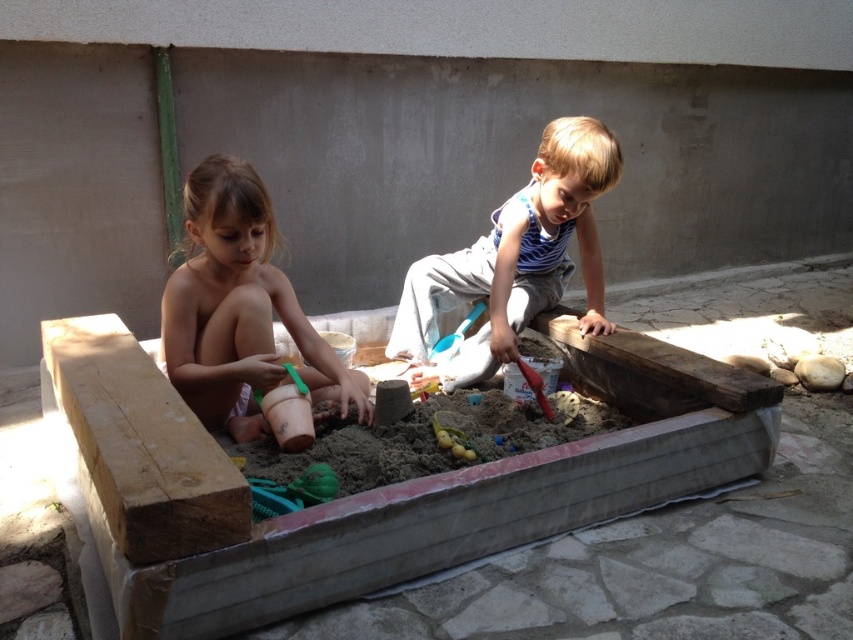
You are a parent supervising the children in the sandbox. You notice the smooth skin girl at left and the striped cotton shirt at center. Which of these two items is smaller in size?

The smooth skin girl at left is smaller in size compared to the striped cotton shirt at center according to the description.

You are a parent watching your children play in the sandbox. You have a small toy car that is the same size as the blue plastic shovel at center. Can the toy car fit in the hands of the smooth skin girl at left?

The smooth skin girl at left has a larger size compared to blue plastic shovel at center. Since the toy car is the same size as the blue plastic shovel at center, the toy car can fit in the hands of the smooth skin girl at left.

You are a parent trying to decide which item to hand to your child first. The striped cotton shirt at center and the blue plastic shovel at center are both within reach. Based on their sizes, which item would you need to pick up first if you want to ensure you can also pick up the other afterward without needing to put down the first item?

The striped cotton shirt at center is wider than the blue plastic shovel at center, so you should pick up the blue plastic shovel at center first. This way, the narrower item is held first, allowing space to hold the wider striped cotton shirt at center afterward without needing to put the first item down.